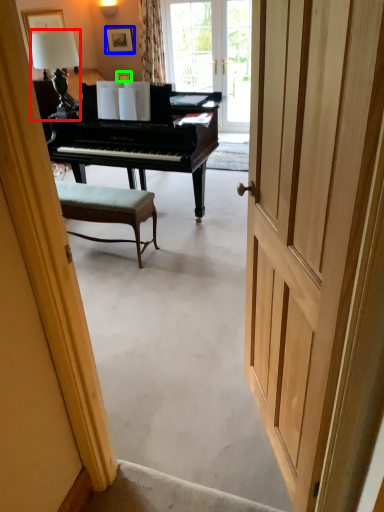
Question: Which is nearer to the lamp (highlighted by a red box)? picture frame (highlighted by a blue box) or picture frame (highlighted by a green box).

Choices:
 (A) picture frame
 (B) picture frame

Answer: (B)